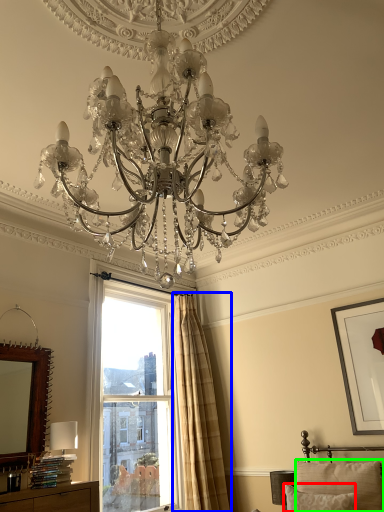
Question: Which object is positioned farthest from pillow (highlighted by a red box)? Select from curtain (highlighted by a blue box) and pillow (highlighted by a green box).

Choices:
 (A) curtain
 (B) pillow

Answer: (A)